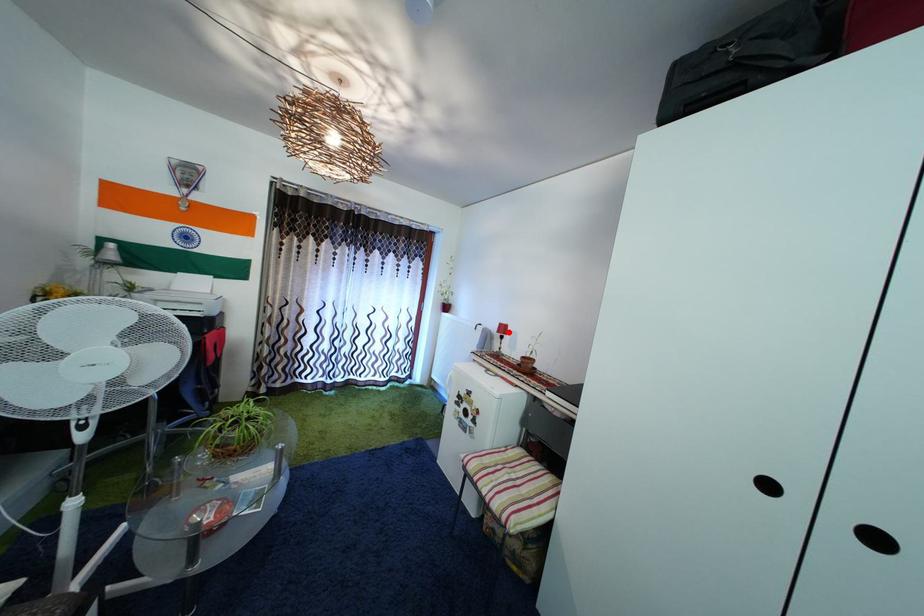
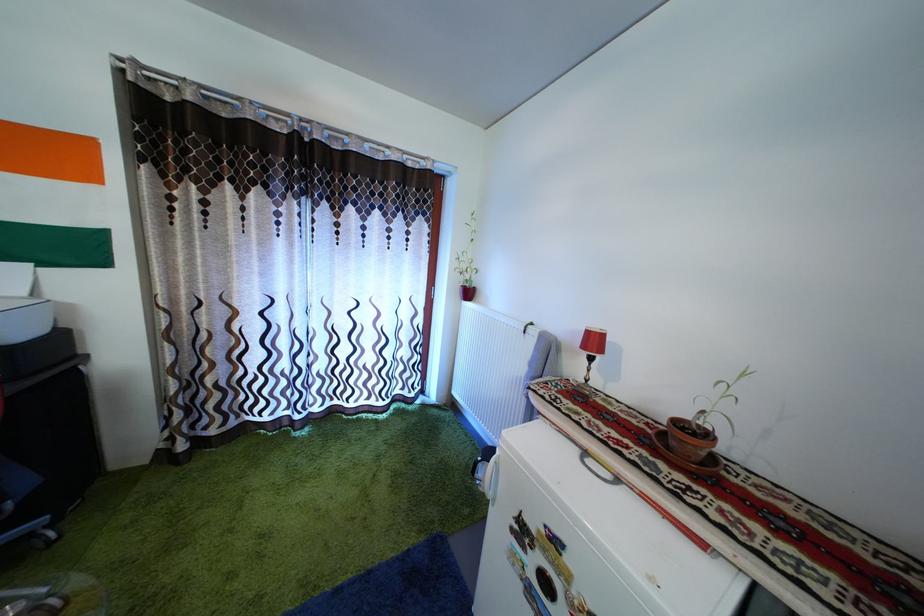
The point at the highlighted location is marked in the first image. Where is the corresponding point in the second image?

(598, 339)